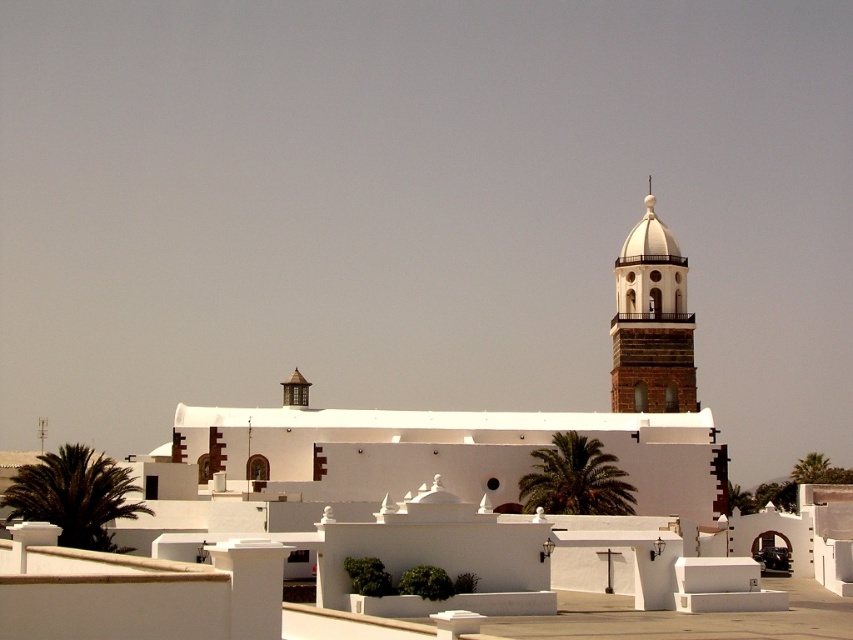
Can you confirm if white stone bell tower at upper right is positioned to the left of green leafy palm tree at center?

Incorrect, white stone bell tower at upper right is not on the left side of green leafy palm tree at center.

This screenshot has width=853, height=640. Identify the location of white stone bell tower at upper right. (651, 323).

Describe the element at coordinates (651, 323) in the screenshot. I see `white stone bell tower at upper right` at that location.

In order to click on white stone bell tower at upper right in this screenshot , I will do `click(651, 323)`.

Does green leafy palm at lower left appear on the left side of green leafy palm tree at center?

Yes, green leafy palm at lower left is to the left of green leafy palm tree at center.

Which is in front, point (113, 476) or point (589, 460)?

Point (113, 476) is in front.

Does point (65, 490) lie behind point (584, 470)?

No, it is in front of (584, 470).

Where is `green leafy palm at lower left`? green leafy palm at lower left is located at coordinates (74, 497).

The width and height of the screenshot is (853, 640). What do you see at coordinates (651, 323) in the screenshot?
I see `white stone bell tower at upper right` at bounding box center [651, 323].

Consider the image. Can you confirm if white stone bell tower at upper right is wider than green leafy palm at lower left?

No.

Does point (643, 396) come behind point (62, 474)?

Yes, point (643, 396) is behind point (62, 474).

Locate an element on the screen. This screenshot has width=853, height=640. white stone bell tower at upper right is located at coordinates (651, 323).